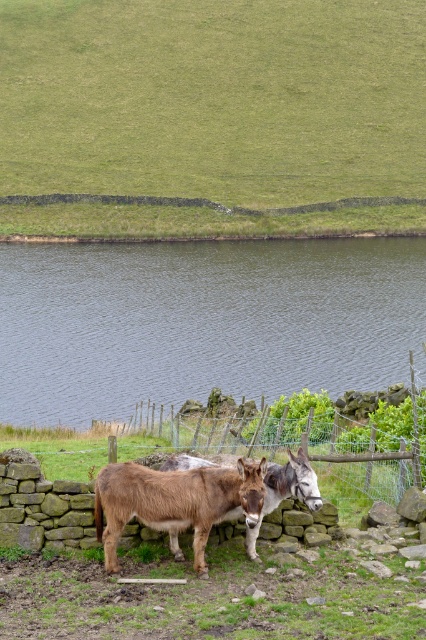
Question: Does brown fuzzy mule at center appear on the left side of brown fuzzy donkey at center?

Choices:
 (A) yes
 (B) no

Answer: (A)

Question: Which point appears closest to the camera in this image?

Choices:
 (A) (402, 481)
 (B) (284, 470)
 (C) (284, 300)

Answer: (B)

Question: Does dark blue water at center appear over brown fuzzy donkey at center?

Choices:
 (A) yes
 (B) no

Answer: (A)

Question: Based on their relative distances, which object is farther from the green grass at upper center?

Choices:
 (A) wire mesh fence at center
 (B) brown fuzzy mule at center
 (C) dark blue water at center

Answer: (B)

Question: In this image, where is wire mesh fence at center located relative to brown fuzzy donkey at center?

Choices:
 (A) left
 (B) right

Answer: (B)

Question: Which object is closer to the camera taking this photo?

Choices:
 (A) brown fuzzy mule at center
 (B) wire mesh fence at center

Answer: (A)